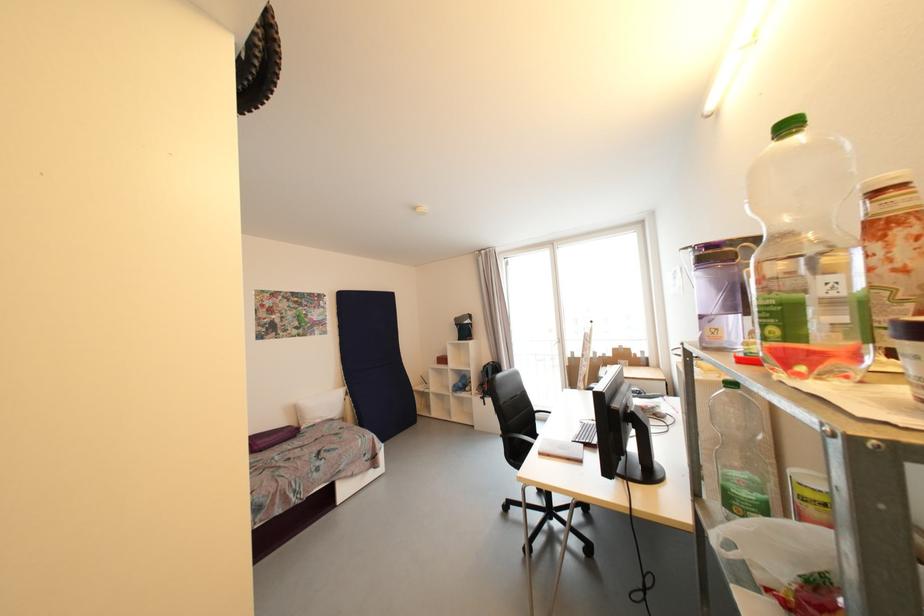
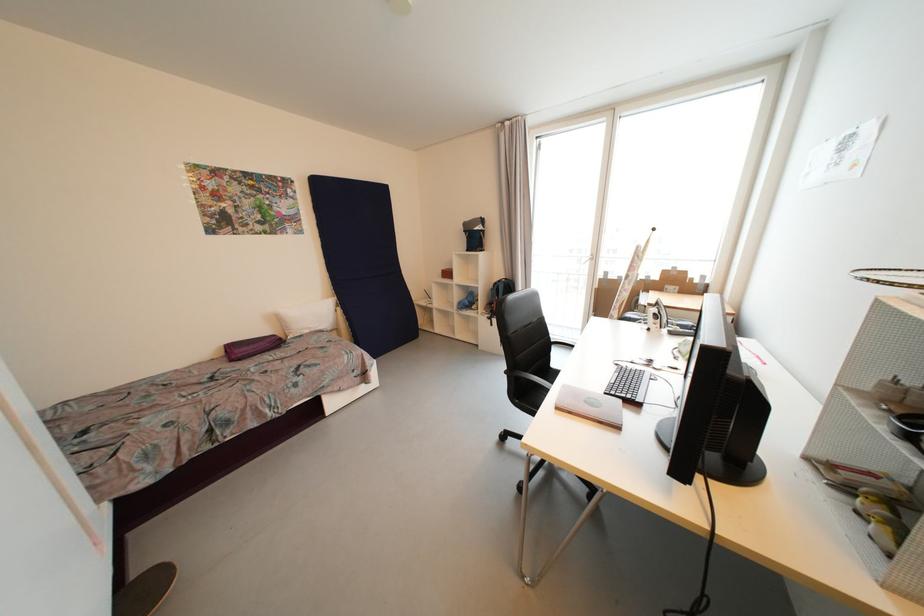
The point at (444, 357) is marked in the first image. Where is the corresponding point in the second image?

(450, 270)